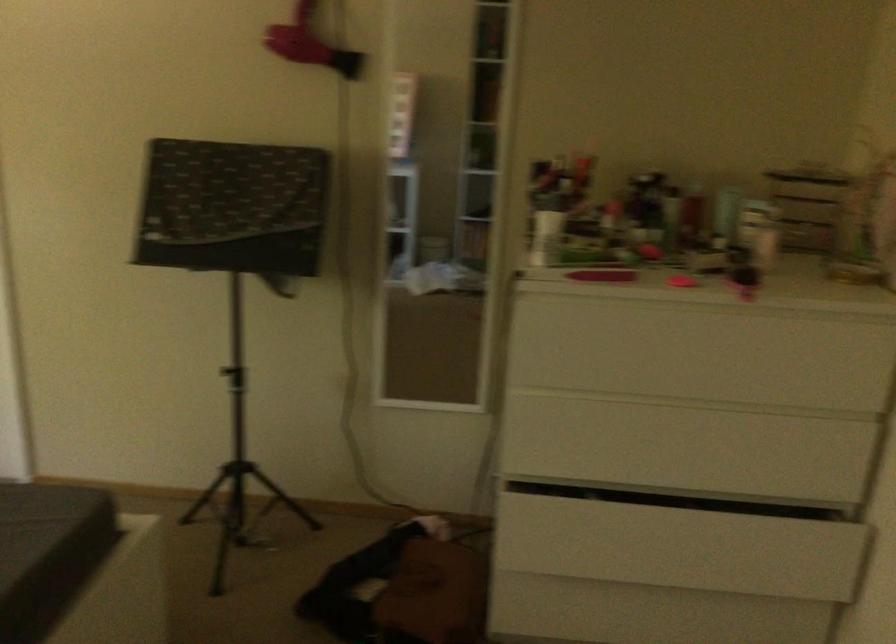
You are a GUI agent. You are given a task and a screenshot of the screen. Output one action in this format:
    pyautogui.click(x=<x>, y=<y>)
    Task: Click on the black adjustment knob
    This screenshot has width=896, height=644.
    Given the screenshot: What is the action you would take?
    pyautogui.click(x=745, y=275)